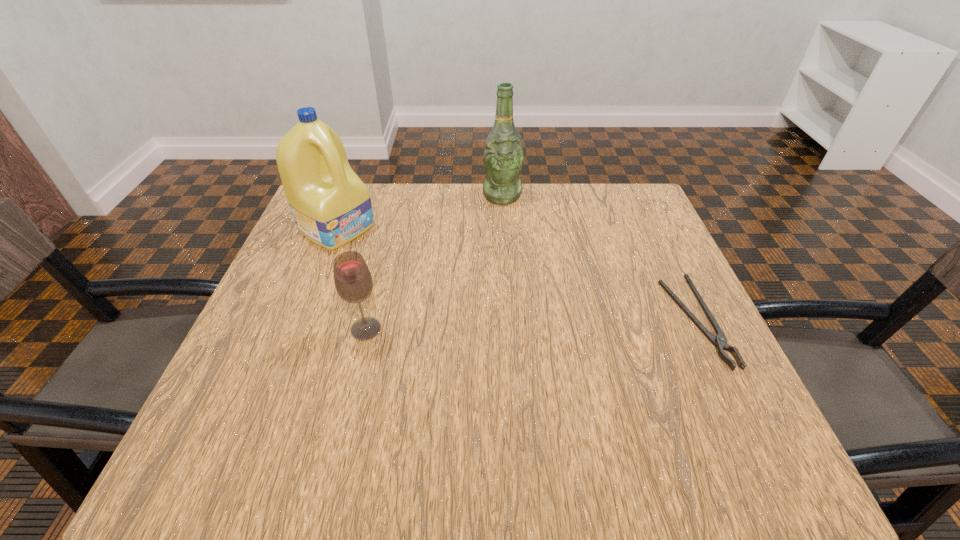
You are a GUI agent. You are given a task and a screenshot of the screen. Output one action in this format:
    pyautogui.click(x=<x>, y=<y>)
    Task: Click on the vacant space located 0.180m on the label of the detergent
    
    Given the screenshot: What is the action you would take?
    pyautogui.click(x=415, y=274)

Where is `free spot located on the surface of the beer bottle`? free spot located on the surface of the beer bottle is located at coordinates (511, 275).

At what (x,y) coordinates should I click in order to perform the action: click on free space located 0.150m on the surface of the beer bottle. Please return your answer as a coordinate pair (x, y). This screenshot has width=960, height=540. Looking at the image, I should click on (507, 241).

Find the location of a particular element. vacant region located on the surface of the beer bottle is located at coordinates (507, 244).

You are a GUI agent. You are given a task and a screenshot of the screen. Output one action in this format:
    pyautogui.click(x=<x>, y=<y>)
    Task: Click on the detergent that is at the far edge
    The width and height of the screenshot is (960, 540).
    Given the screenshot: What is the action you would take?
    point(331,206)

The image size is (960, 540). Identify the location of beer bottle located in the far edge section of the desktop. (503, 157).

Image resolution: width=960 pixels, height=540 pixels. In order to click on object at the left edge in this screenshot , I will do `click(331, 206)`.

Image resolution: width=960 pixels, height=540 pixels. I want to click on object that is at the right edge, so click(x=720, y=341).

In order to click on object at the far left corner in this screenshot , I will do `click(331, 206)`.

In the image, there is a desktop. At what (x,y) coordinates should I click in order to perform the action: click on vacant space at the far edge. Please return your answer as a coordinate pair (x, y). Looking at the image, I should click on (383, 186).